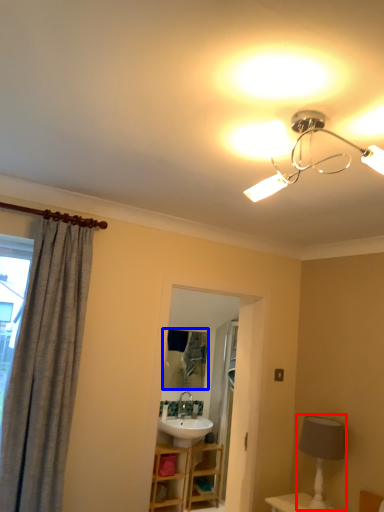
Question: Which object appears farthest to the camera in this image, table lamp (highlighted by a red box) or mirror (highlighted by a blue box)?

Choices:
 (A) table lamp
 (B) mirror

Answer: (B)